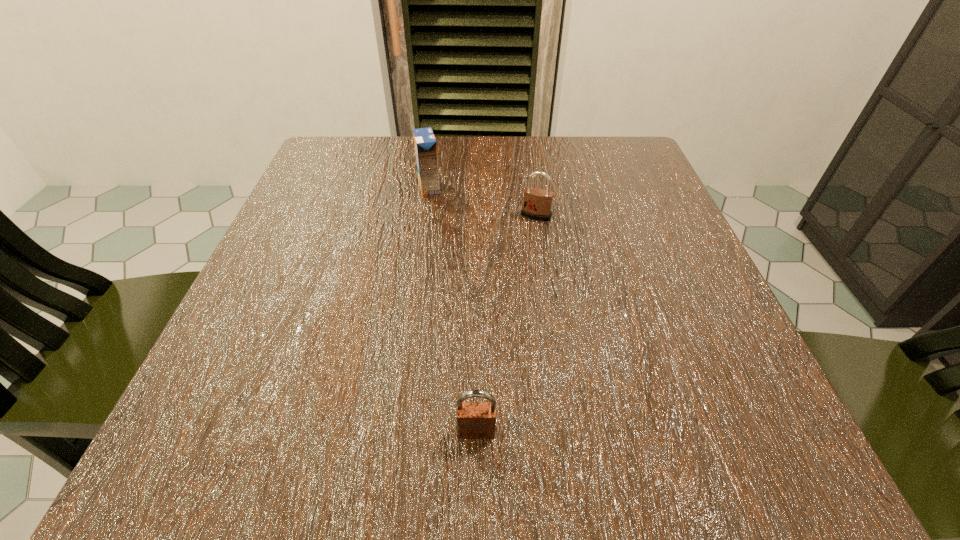
Locate an element on the screen. object at the near edge is located at coordinates (475, 420).

At what (x,y) coordinates should I click in order to perform the action: click on free spot at the far edge of the desktop. Please return your answer as a coordinate pair (x, y). The image size is (960, 540). Looking at the image, I should click on (535, 185).

Identify the location of vacant space at the near edge of the desktop. This screenshot has height=540, width=960. (424, 474).

Locate an element on the screen. The width and height of the screenshot is (960, 540). free region at the left edge is located at coordinates (345, 208).

You are a GUI agent. You are given a task and a screenshot of the screen. Output one action in this format:
    pyautogui.click(x=<x>, y=<y>)
    Task: Click on the vacant space at the right edge of the desktop
    This screenshot has width=960, height=540.
    Given the screenshot: What is the action you would take?
    pyautogui.click(x=678, y=227)

At what (x,y) coordinates should I click in order to perform the action: click on free space at the far left corner. Please return your answer as a coordinate pair (x, y). Looking at the image, I should click on [x=365, y=176].

This screenshot has height=540, width=960. Identify the location of vacant space at the near left corner of the desktop. (249, 471).

In the image, there is a desktop. At what (x,y) coordinates should I click in order to perform the action: click on vacant space at the far right corner. Please return your answer as a coordinate pair (x, y). This screenshot has width=960, height=540. Looking at the image, I should click on (615, 143).

Locate an element on the screen. The image size is (960, 540). free spot at the near right corner of the desktop is located at coordinates (651, 420).

Image resolution: width=960 pixels, height=540 pixels. Find the location of `free space between the second object from left to right and the second farthest object`. free space between the second object from left to right and the second farthest object is located at coordinates (506, 323).